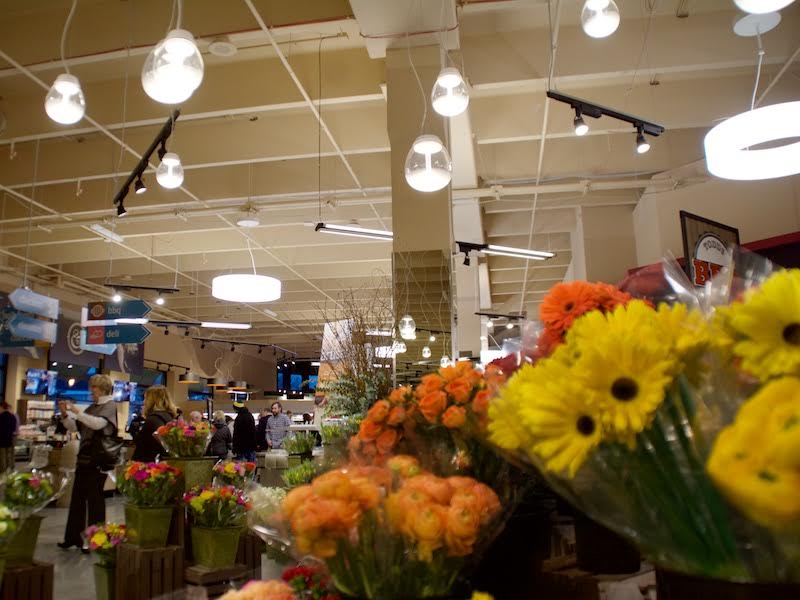
At what (x,y) coordinates should I click in order to perform the action: click on ceiling. Please return your answer as a coordinate pair (x, y). The image size is (800, 600). Looking at the image, I should click on (278, 122).